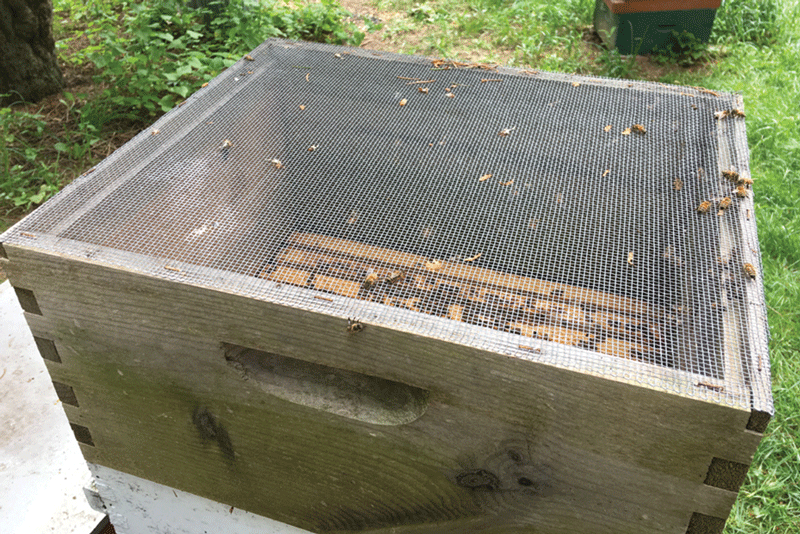
Where is `frames`? This screenshot has width=800, height=534. frames is located at coordinates (618, 300), (610, 320), (617, 345).